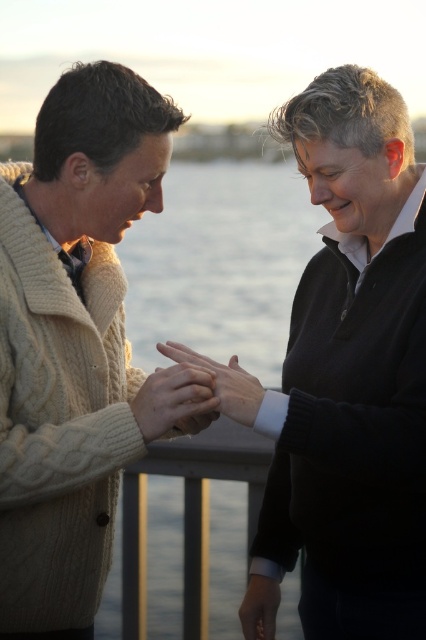
Question: Estimate the real-world distances between objects in this image. Which object is closer to the matte black hand at lower center?

Choices:
 (A) matte beige sweater at center
 (B) matte beige hand at center

Answer: (A)

Question: Can you confirm if matte beige hand at center is positioned below matte black hand at lower center?

Choices:
 (A) yes
 (B) no

Answer: (B)

Question: Is matte beige sweater at center above matte black hand at lower center?

Choices:
 (A) yes
 (B) no

Answer: (A)

Question: Which of the following is the closest to the observer?

Choices:
 (A) (250, 616)
 (B) (247, 404)
 (C) (178, 392)

Answer: (C)

Question: Observing the image, what is the correct spatial positioning of matte beige sweater at center in reference to matte beige hand at center?

Choices:
 (A) left
 (B) right

Answer: (A)

Question: Which of these objects is positioned farthest from the matte beige hand at center?

Choices:
 (A) matte black hand at lower center
 (B) matte beige sweater at center

Answer: (A)